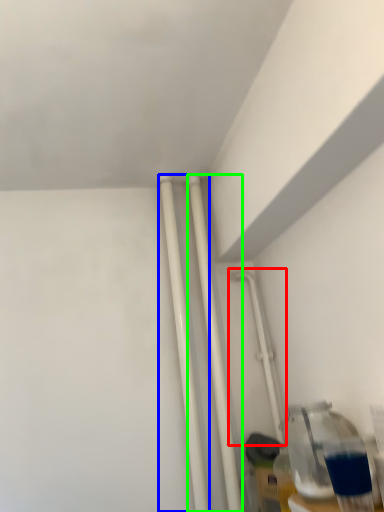
Question: Estimate the real-world distances between objects in this image. Which object is farther from water pipe (highlighted by a red box), pipe (highlighted by a blue box) or pipe (highlighted by a green box)?

Choices:
 (A) pipe
 (B) pipe

Answer: (A)